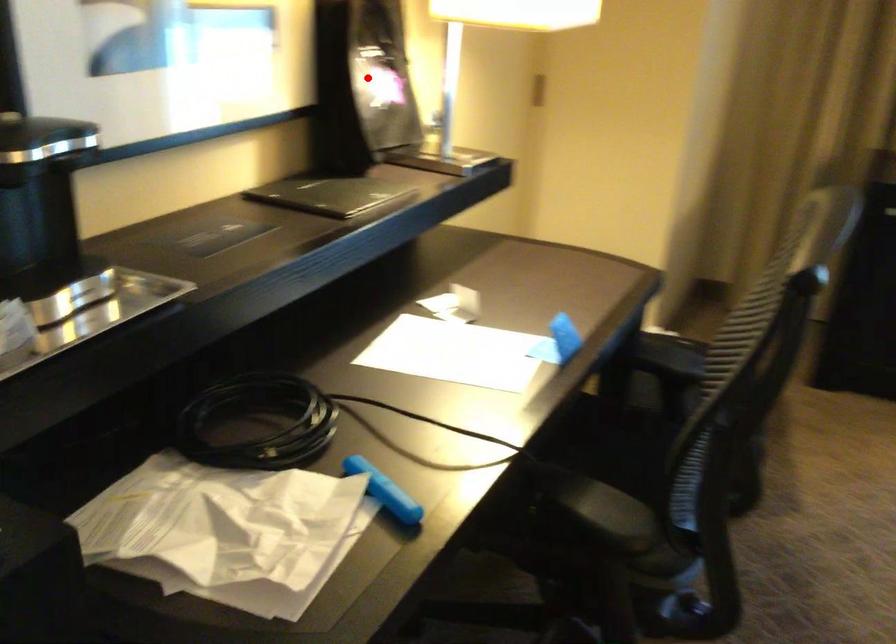
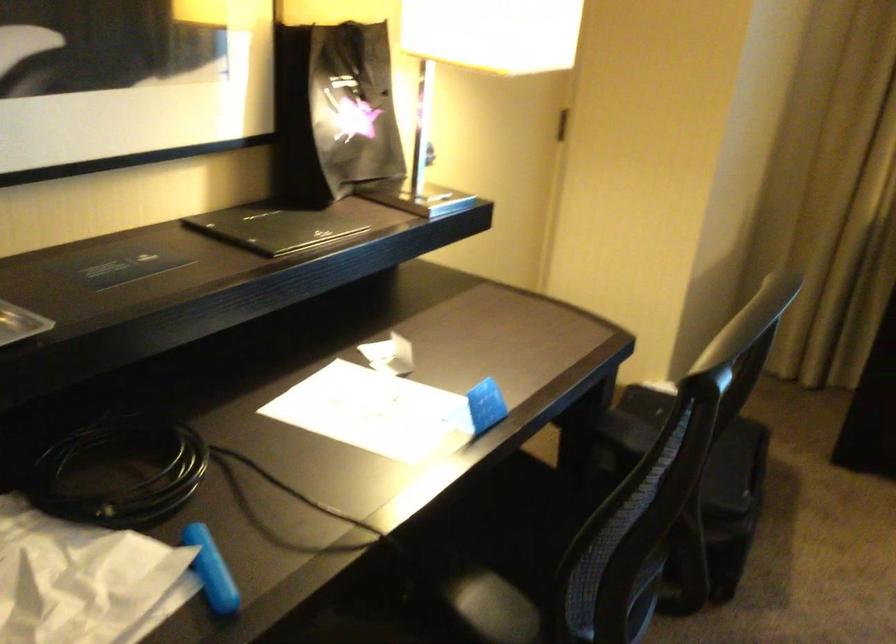
The point at the highlighted location is marked in the first image. Where is the corresponding point in the second image?

(334, 111)